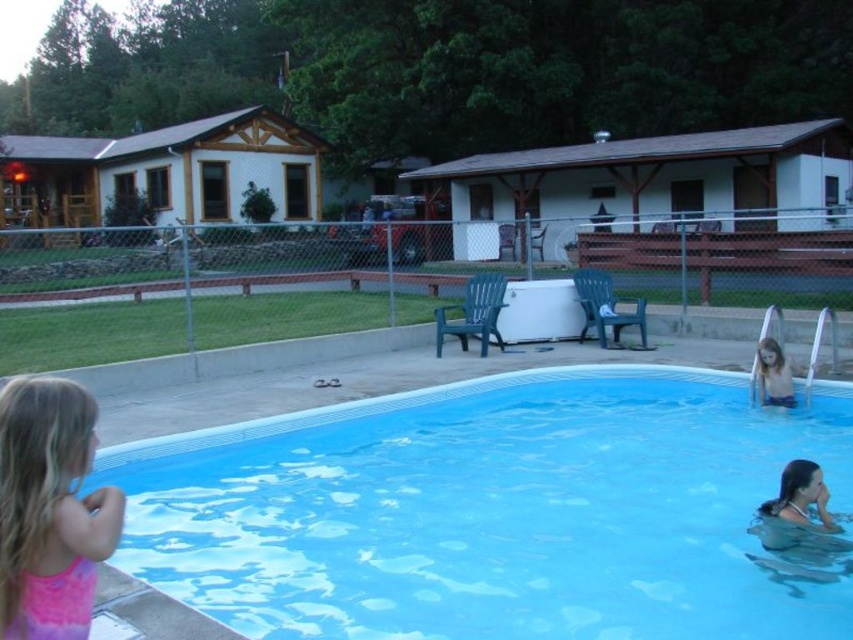
Question: Based on their relative distances, which object is nearer to the smooth skin child at lower right?

Choices:
 (A) blue smooth pool at lower center
 (B) pink fabric dress at lower left

Answer: (A)

Question: Which point is farther to the camera?

Choices:
 (A) (57, 570)
 (B) (755, 449)

Answer: (B)

Question: Which point is farther to the camera?

Choices:
 (A) blue smooth pool at lower center
 (B) pink fabric dress at lower left

Answer: (A)

Question: Is blue smooth pool at lower center positioned behind smooth skin child at lower right?

Choices:
 (A) no
 (B) yes

Answer: (A)

Question: Does pink fabric dress at lower left come behind smooth skin child at lower right?

Choices:
 (A) no
 (B) yes

Answer: (A)

Question: Can you confirm if blue smooth pool at lower center is bigger than pink fabric dress at lower left?

Choices:
 (A) yes
 (B) no

Answer: (A)